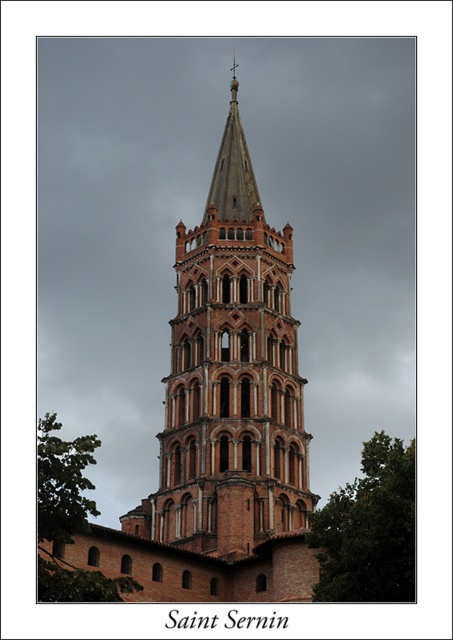
Question: Which point is farther to the camera?

Choices:
 (A) (162, 445)
 (B) (43, 426)

Answer: (B)

Question: Does green leafy tree at lower right have a greater width compared to green leafy tree at lower left?

Choices:
 (A) no
 (B) yes

Answer: (A)

Question: Does brown brick tower at center appear under green leafy tree at lower left?

Choices:
 (A) yes
 (B) no

Answer: (B)

Question: Is brown brick tower at center bigger than green leafy tree at lower right?

Choices:
 (A) yes
 (B) no

Answer: (A)

Question: Which object is the farthest from the green leafy tree at lower left?

Choices:
 (A) green leafy tree at lower right
 (B) brown brick tower at center

Answer: (A)

Question: Among these points, which one is farthest from the camera?

Choices:
 (A) (41, 508)
 (B) (225, 403)
 (C) (403, 458)

Answer: (B)